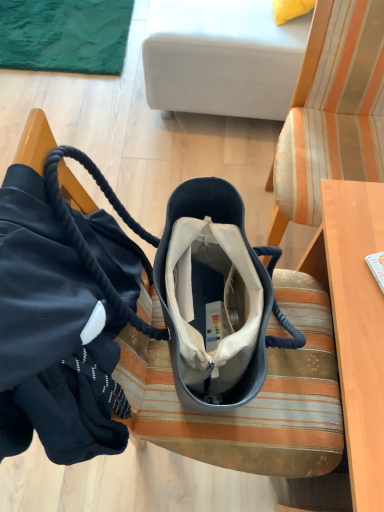
Question: In the image, is velvet bag at center on the left side or the right side of satin black handbag at lower left?

Choices:
 (A) left
 (B) right

Answer: (B)

Question: In terms of width, does velvet bag at center look wider or thinner when compared to satin black handbag at lower left?

Choices:
 (A) wide
 (B) thin

Answer: (A)

Question: Estimate the real-world distances between objects in this image. Which object is closer to the satin black handbag at lower left?

Choices:
 (A) velvet bag at center
 (B) striped fabric chair at center
 (C) white fabric studio couch at upper center

Answer: (A)

Question: Which is farther from the satin black handbag at lower left?

Choices:
 (A) white fabric studio couch at upper center
 (B) velvet bag at center
 (C) striped fabric chair at center

Answer: (A)